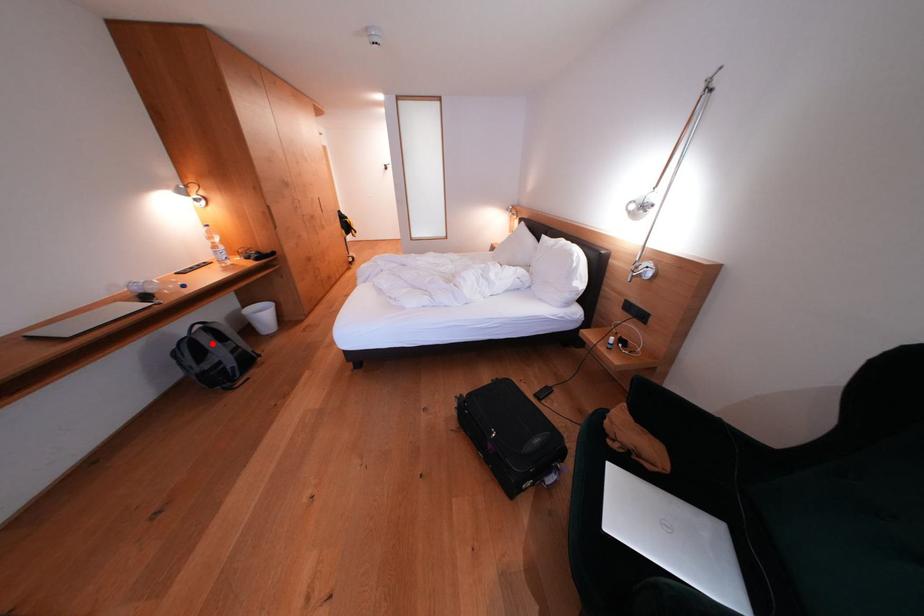
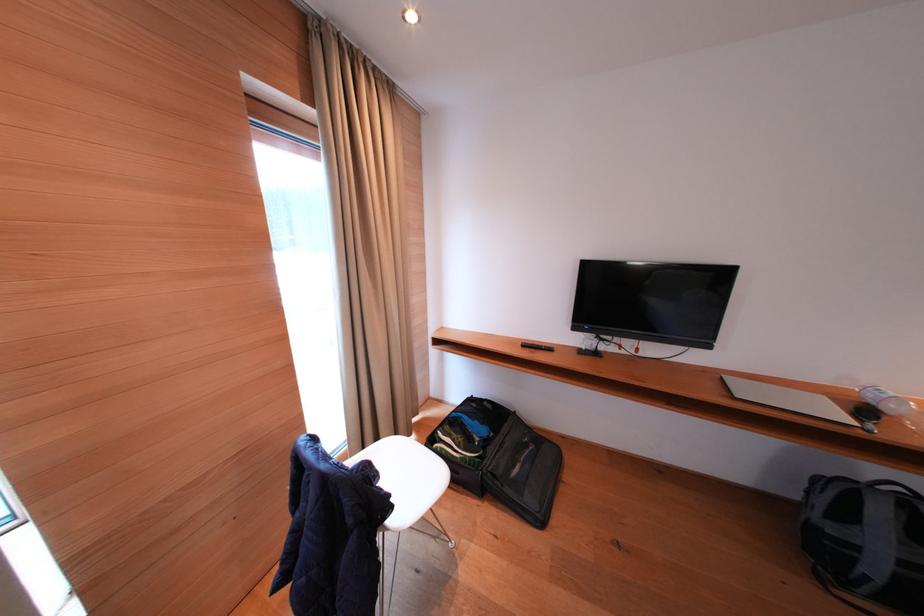
Where in the second image is the point corresponding to the highlighted location from the first image?

(888, 515)